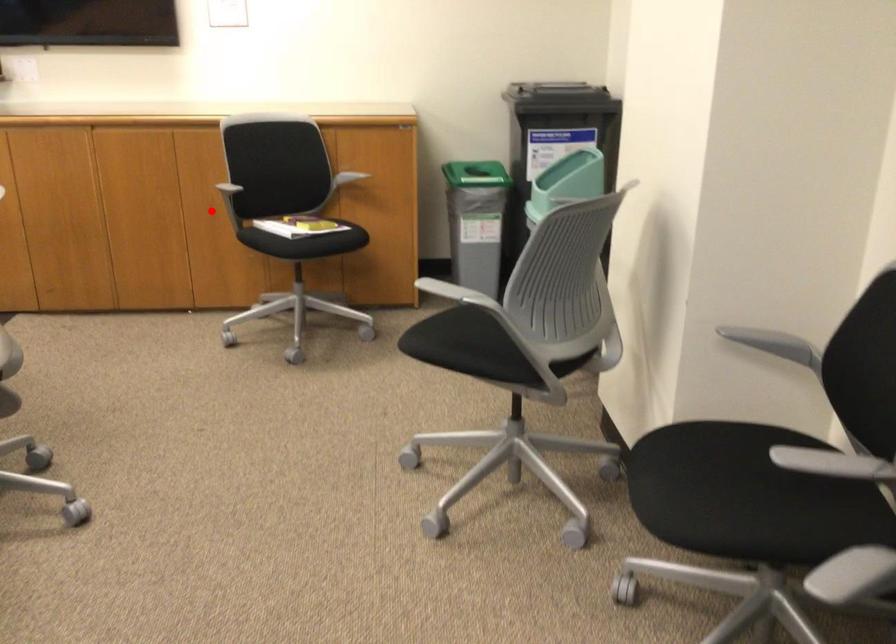
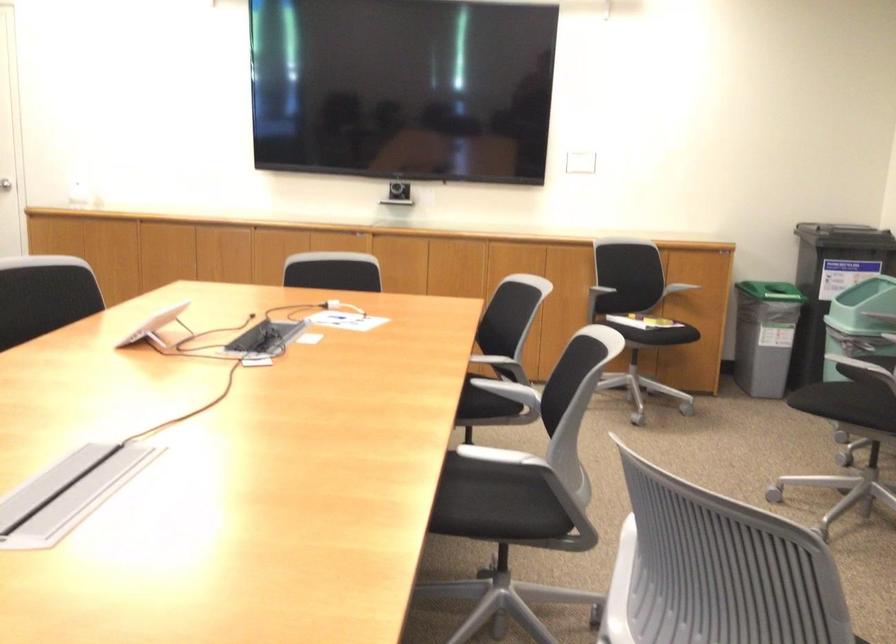
The point at the highlighted location is marked in the first image. Where is the corresponding point in the second image?

(571, 290)